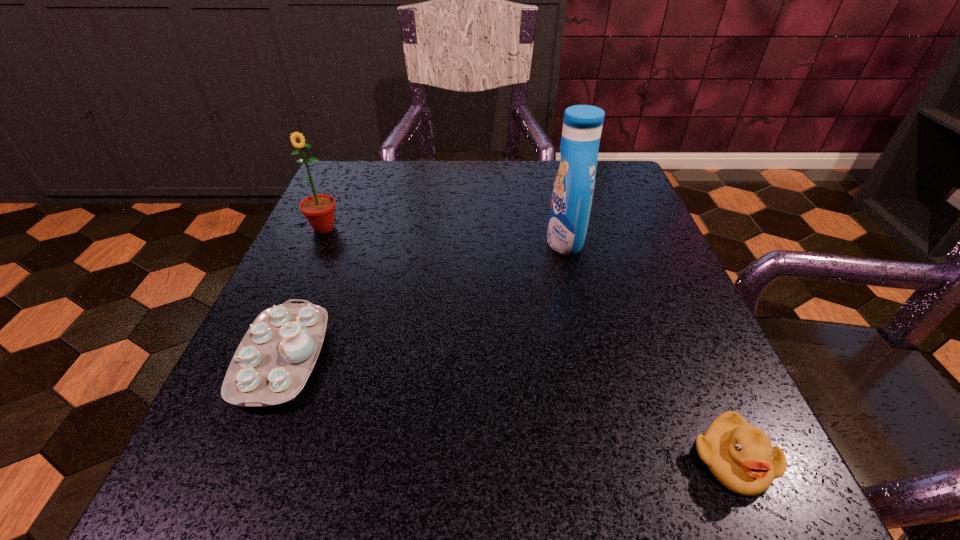
I want to click on empty space that is in between the chinaware and the detergent, so click(x=423, y=299).

What are the coordinates of `vacant area between the third object from left to right and the chinaware` in the screenshot? It's located at (423, 299).

At what (x,y) coordinates should I click in order to perform the action: click on vacant space that's between the chinaware and the nearest object. Please return your answer as a coordinate pair (x, y). Looking at the image, I should click on (507, 409).

This screenshot has height=540, width=960. Find the location of `object that is the third closest to the tallest object`. object that is the third closest to the tallest object is located at coordinates (319, 210).

Where is `object that stands as the third closest to the sunflower`? The height and width of the screenshot is (540, 960). object that stands as the third closest to the sunflower is located at coordinates (740, 455).

Where is `free space that satisfies the following two spatial constraints: 1. on the face of the sunflower; 2. on the left side of the third farthest object`? free space that satisfies the following two spatial constraints: 1. on the face of the sunflower; 2. on the left side of the third farthest object is located at coordinates (266, 358).